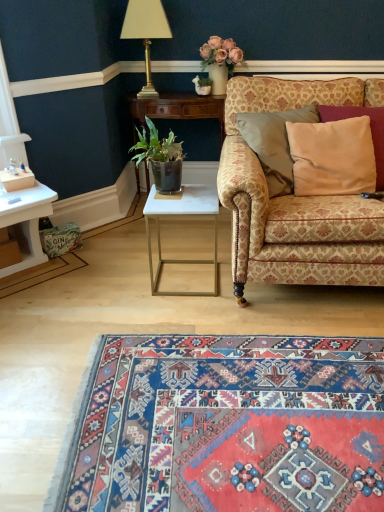
You are a GUI agent. You are given a task and a screenshot of the screen. Output one action in this format:
    pyautogui.click(x=<x>, y=<y>)
    Task: Click on the vacant location behind white marble table at center, the 1th table viewed from the front
    The height and width of the screenshot is (512, 384).
    Given the screenshot: What is the action you would take?
    click(x=180, y=247)